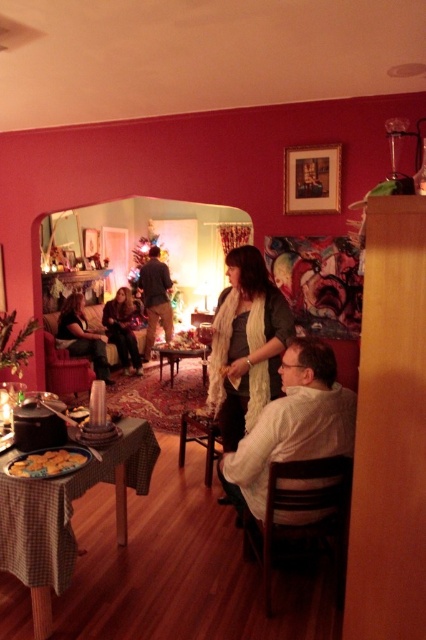
How distant is white matte shirt at lower right from velvet red armchair at left?

white matte shirt at lower right is 9.61 feet from velvet red armchair at left.

Is white matte shirt at lower right above velvet red armchair at left?

Actually, white matte shirt at lower right is below velvet red armchair at left.

Find the location of a particular element. This screenshot has width=426, height=640. white matte shirt at lower right is located at coordinates (291, 424).

Does matte black sweater at center have a greater height compared to woodenwoodentable at center?

Correct, matte black sweater at center is much taller as woodenwoodentable at center.

Between point (126, 360) and point (184, 355), which one is positioned in front?

Point (184, 355)

Which is in front, point (114, 342) or point (193, 349)?

Positioned in front is point (193, 349).

I want to click on matte black sweater at center, so click(121, 330).

Consider the image. Is green checkered tablecloth at lower left thinner than woodenwoodentable at center?

Yes, green checkered tablecloth at lower left is thinner than woodenwoodentable at center.

In the scene shown: Is green checkered tablecloth at lower left to the right of woodenwoodentable at center from the viewer's perspective?

Incorrect, green checkered tablecloth at lower left is not on the right side of woodenwoodentable at center.

Between point (120, 451) and point (178, 356), which one is positioned behind?

The point (178, 356) is behind.

Where is `green checkered tablecloth at lower left`? green checkered tablecloth at lower left is located at coordinates (66, 515).